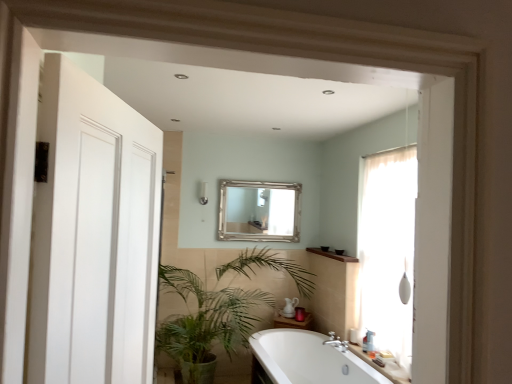
You are a GUI agent. You are given a task and a screenshot of the screen. Output one action in this format:
    pyautogui.click(x=<x>, y=<y>)
    Task: Click on the free space above silver metallic mirror at upper center (from a real-world perspective)
    This screenshot has height=384, width=512.
    Given the screenshot: What is the action you would take?
    pyautogui.click(x=261, y=183)